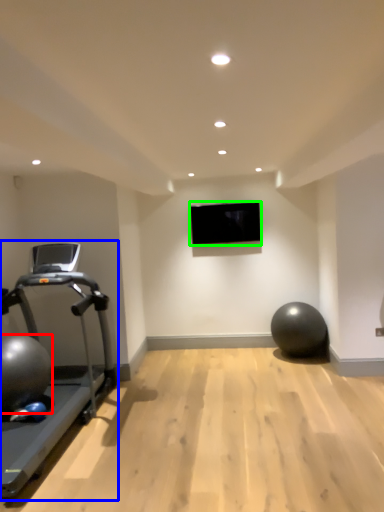
Question: Considering the real-world distances, which object is farthest from ball (highlighted by a red box)? treadmill (highlighted by a blue box) or projection screen (highlighted by a green box)?

Choices:
 (A) treadmill
 (B) projection screen

Answer: (B)